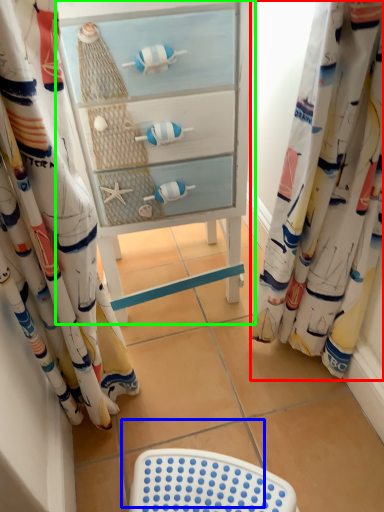
Question: Which is nearer to the curtain (highlighted by a red box)? tile (highlighted by a blue box) or furniture (highlighted by a green box).

Choices:
 (A) tile
 (B) furniture

Answer: (B)